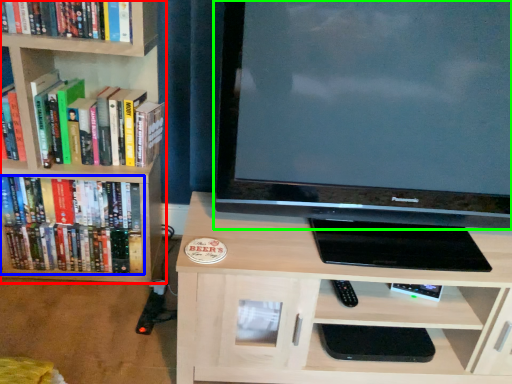
Question: Which object is positioned farthest from bookcase (highlighted by a red box)? Select from book (highlighted by a blue box) and television (highlighted by a green box).

Choices:
 (A) book
 (B) television

Answer: (B)